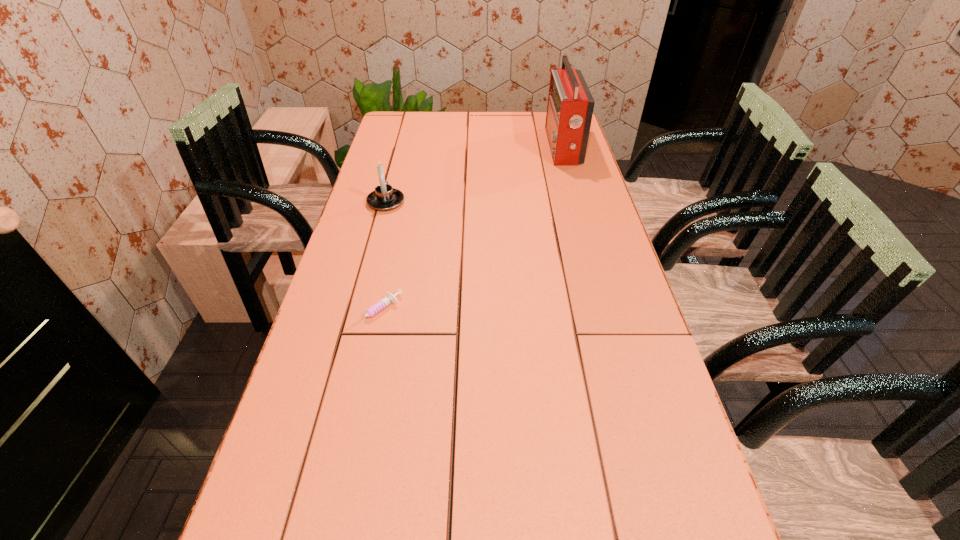
At what (x,y) coordinates should I click in order to perform the action: click on vacant space positioned 0.300m with a handle on the side of the candle holder. Please return your answer as a coordinate pair (x, y). Looking at the image, I should click on (400, 148).

Where is `vacant space located with a handle on the side of the candle holder`? This screenshot has height=540, width=960. vacant space located with a handle on the side of the candle holder is located at coordinates (400, 148).

The image size is (960, 540). In order to click on vacant point located 0.220m on the right of the syringe in this screenshot , I will do `click(490, 313)`.

In order to click on object present at the far edge in this screenshot , I will do `click(570, 106)`.

At what (x,y) coordinates should I click in order to perform the action: click on candle holder positioned at the left edge. Please return your answer as a coordinate pair (x, y). This screenshot has width=960, height=540. Looking at the image, I should click on (x=384, y=198).

Where is `syringe located at the left edge`? syringe located at the left edge is located at coordinates (389, 299).

Where is `object that is positioned at the right edge`? The width and height of the screenshot is (960, 540). object that is positioned at the right edge is located at coordinates (570, 106).

Locate an element on the screen. object at the far right corner is located at coordinates (570, 106).

Find the location of a particular element. free point at the far edge is located at coordinates (473, 113).

The height and width of the screenshot is (540, 960). I want to click on free space at the left edge, so click(x=324, y=298).